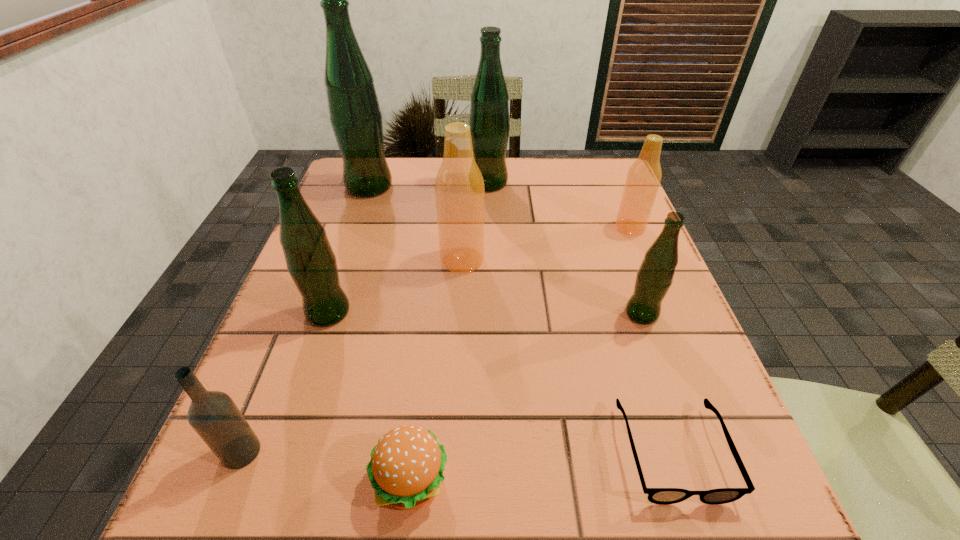
The height and width of the screenshot is (540, 960). In order to click on the biggest green beer bottle in this screenshot , I will do `click(354, 112)`.

Locate an element on the screen. The height and width of the screenshot is (540, 960). the tallest object is located at coordinates (354, 112).

The height and width of the screenshot is (540, 960). What are the coordinates of `the fifth shortest beer bottle` in the screenshot? It's located at (489, 123).

Where is `the second green beer bottle from right to left`? The width and height of the screenshot is (960, 540). the second green beer bottle from right to left is located at coordinates (489, 123).

Where is `the bigger tan beer bottle`? the bigger tan beer bottle is located at coordinates (459, 186).

The image size is (960, 540). Identify the location of the fourth farthest beer bottle. (459, 186).

This screenshot has width=960, height=540. In order to click on the third biggest green beer bottle in this screenshot , I will do `click(311, 262)`.

Where is `the smallest green beer bottle`? the smallest green beer bottle is located at coordinates (654, 278).

Find the location of `the fourth nearest beer bottle`. the fourth nearest beer bottle is located at coordinates (643, 179).

Identify the location of the right tan beer bottle. (643, 179).